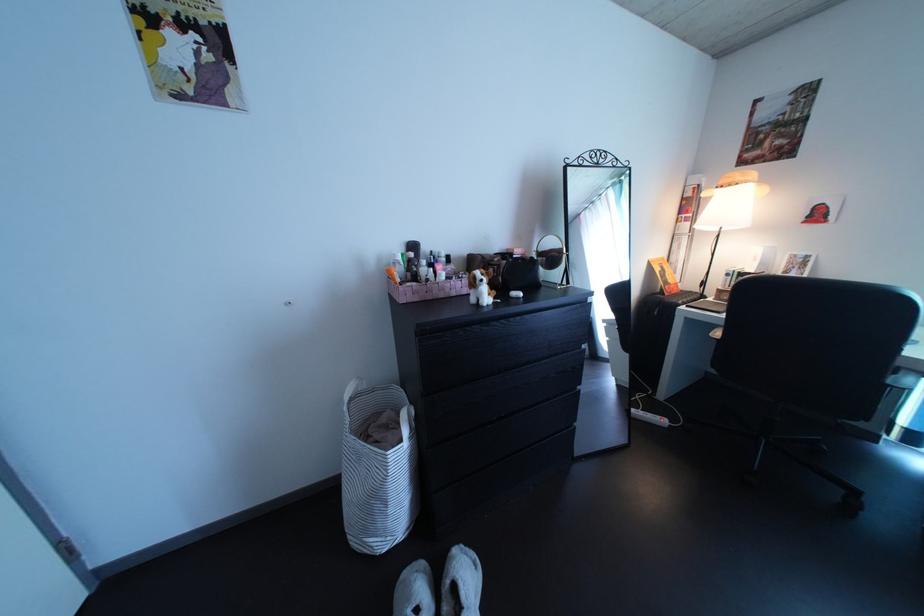
Identify the location of white table lamp. Image resolution: width=924 pixels, height=616 pixels. (728, 208).